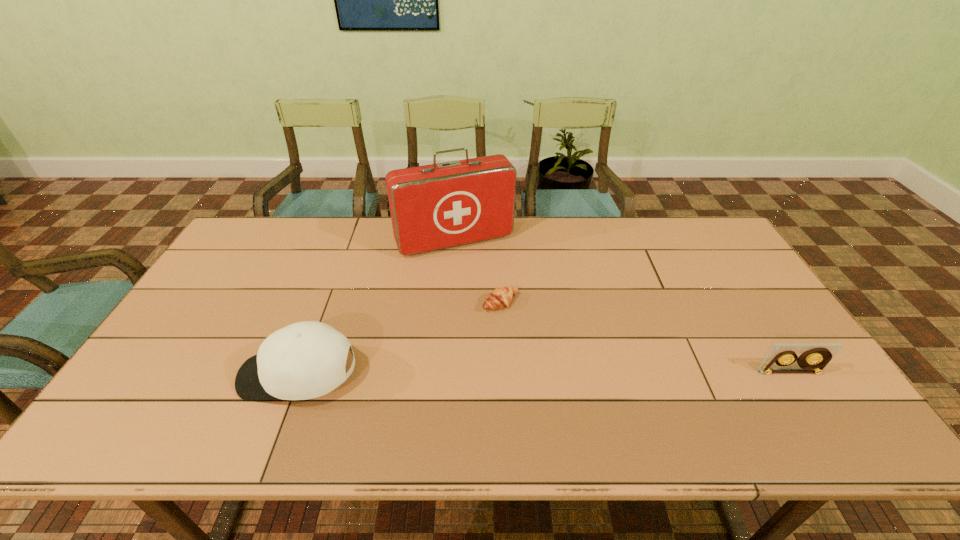
Locate an element on the screen. vacant space that's between the pastry and the second shortest object is located at coordinates (645, 338).

Identify the location of free space between the videotape and the first-aid kit. (622, 307).

Image resolution: width=960 pixels, height=540 pixels. I want to click on free space between the second tallest object and the third tallest object, so click(544, 374).

The width and height of the screenshot is (960, 540). I want to click on vacant space in between the tallest object and the pastry, so click(x=477, y=272).

Where is `free space between the shortest object and the rightmost object`? Image resolution: width=960 pixels, height=540 pixels. free space between the shortest object and the rightmost object is located at coordinates (645, 338).

Locate an element on the screen. This screenshot has height=540, width=960. free space that is in between the third tallest object and the first-aid kit is located at coordinates (622, 307).

Find the location of `the third closest object to the shortest object`. the third closest object to the shortest object is located at coordinates (814, 357).

Find the location of a particular element. The width and height of the screenshot is (960, 540). object that is the third nearest to the shortest object is located at coordinates (814, 357).